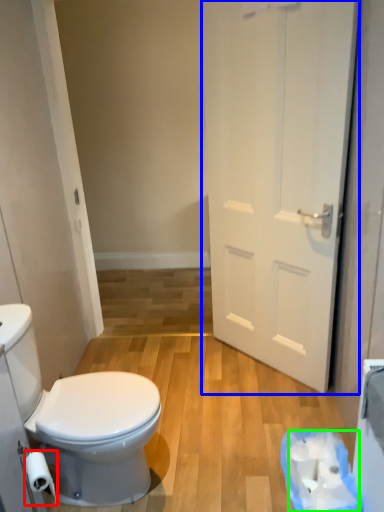
Question: Estimate the real-world distances between objects in this image. Which object is farther from toilet paper (highlighted by a red box), door (highlighted by a blue box) or toilet paper (highlighted by a green box)?

Choices:
 (A) door
 (B) toilet paper

Answer: (A)